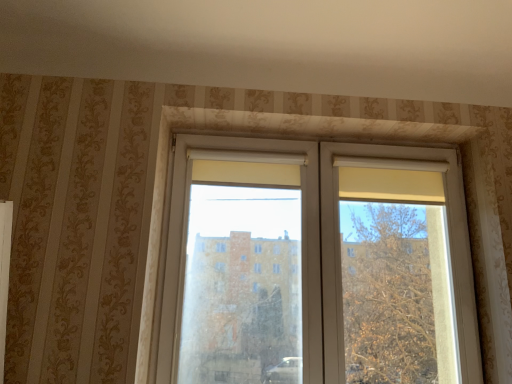
Question: Should I look upward or downward to see white plastic window at center?

Choices:
 (A) up
 (B) down

Answer: (B)

Question: Would you consider white plastic window at center to be distant from white plastic screen door at center?

Choices:
 (A) no
 (B) yes

Answer: (A)

Question: From the image's perspective, would you say white plastic window at center is positioned over white plastic screen door at center?

Choices:
 (A) no
 (B) yes

Answer: (B)

Question: Is white plastic window at center smaller than white plastic screen door at center?

Choices:
 (A) yes
 (B) no

Answer: (A)

Question: Can you confirm if white plastic window at center is taller than white plastic screen door at center?

Choices:
 (A) yes
 (B) no

Answer: (A)

Question: Considering the relative sizes of white plastic window at center and white plastic screen door at center in the image provided, is white plastic window at center thinner than white plastic screen door at center?

Choices:
 (A) no
 (B) yes

Answer: (B)

Question: Considering the relative sizes of white plastic window at center and white plastic screen door at center in the image provided, is white plastic window at center wider than white plastic screen door at center?

Choices:
 (A) yes
 (B) no

Answer: (B)

Question: Is white plastic screen door at center thinner than white plastic window at center?

Choices:
 (A) yes
 (B) no

Answer: (B)

Question: Can you confirm if white plastic screen door at center is shorter than white plastic window at center?

Choices:
 (A) yes
 (B) no

Answer: (A)

Question: Considering the relative sizes of white plastic screen door at center and white plastic window at center in the image provided, is white plastic screen door at center bigger than white plastic window at center?

Choices:
 (A) yes
 (B) no

Answer: (A)

Question: From a real-world perspective, is white plastic screen door at center physically below white plastic window at center?

Choices:
 (A) no
 (B) yes

Answer: (B)

Question: Is white plastic window at center at the back of white plastic screen door at center?

Choices:
 (A) no
 (B) yes

Answer: (B)

Question: Does white plastic screen door at center contain white plastic window at center?

Choices:
 (A) yes
 (B) no

Answer: (A)

Question: Based on their sizes in the image, would you say white plastic window at center is bigger or smaller than white plastic screen door at center?

Choices:
 (A) big
 (B) small

Answer: (B)